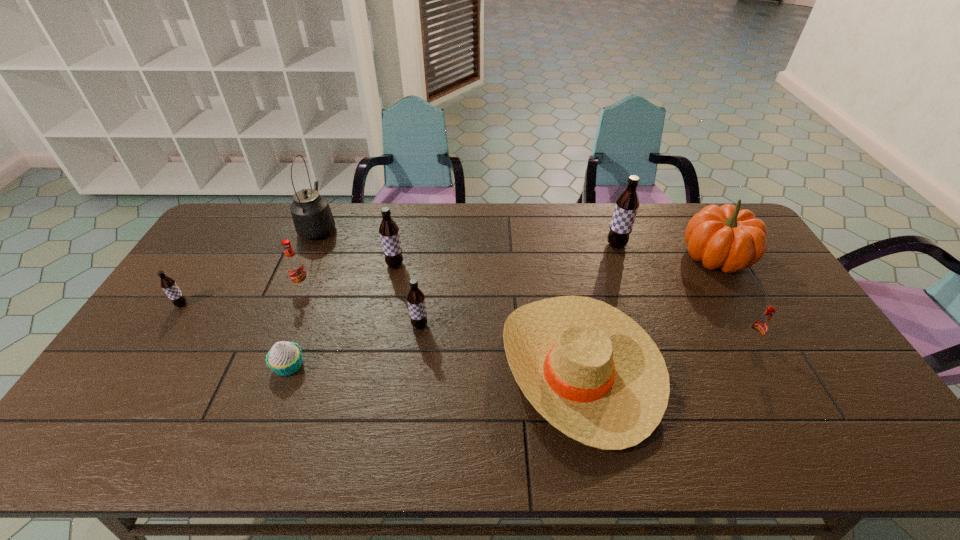
The image size is (960, 540). Identify the location of free space between the pumpkin and the second farthest brown root beer. (556, 261).

The image size is (960, 540). Find the location of `vacant area that lies between the kettle and the third brown root beer from left to right`. vacant area that lies between the kettle and the third brown root beer from left to right is located at coordinates (370, 276).

Where is `free space that is in between the kettle and the farthest root beer`? This screenshot has width=960, height=540. free space that is in between the kettle and the farthest root beer is located at coordinates (468, 235).

Find the location of a particular element. The width and height of the screenshot is (960, 540). free space between the fifth farthest root beer and the white cupcake is located at coordinates (354, 346).

Locate an element on the screen. free spot between the kettle and the cupcake is located at coordinates (304, 296).

Where is `free point between the bigger red root beer and the pumpkin`? The width and height of the screenshot is (960, 540). free point between the bigger red root beer and the pumpkin is located at coordinates (509, 271).

Choose which object is the eighth nearest neighbor to the leftmost object. Please provide its 2D coordinates. Your answer should be formatted as a tuple, i.e. [(x, y)], where the tuple contains the x and y coordinates of a point satisfying the conditions above.

[(727, 237)]

Image resolution: width=960 pixels, height=540 pixels. In order to click on object that can be found as the closest to the sunhat in this screenshot , I will do click(416, 299).

In order to click on root beer object that ranks as the third closest to the rightmost root beer in this screenshot , I will do `click(389, 231)`.

Identify which root beer is the fourth closest to the smallest brown root beer. Please provide its 2D coordinates. Your answer should be formatted as a tuple, i.e. [(x, y)], where the tuple contains the x and y coordinates of a point satisfying the conditions above.

[(626, 207)]